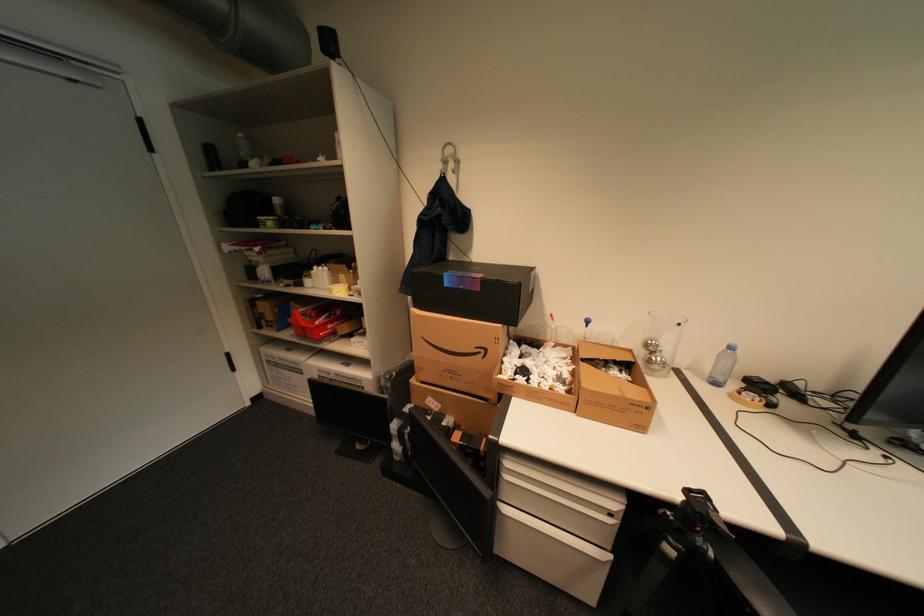
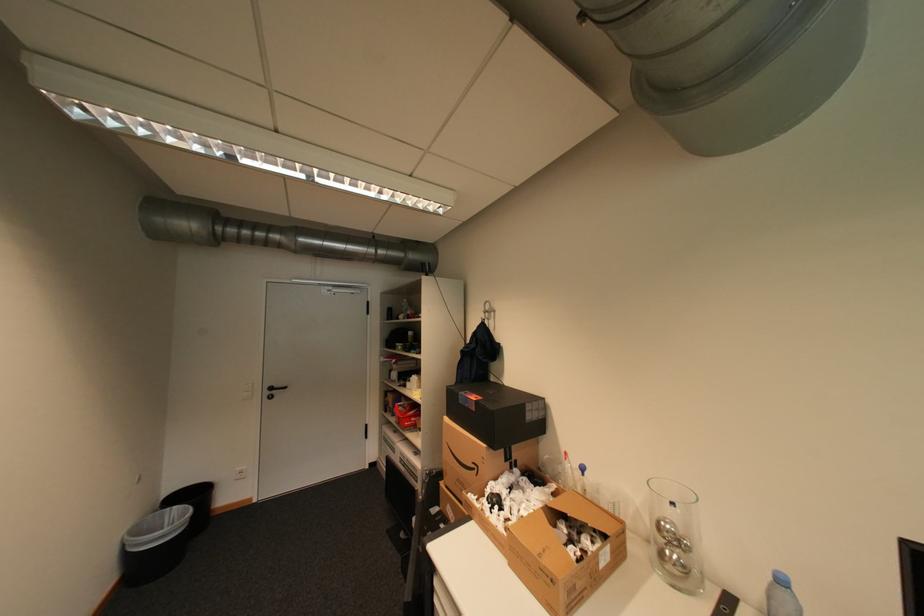
The images are taken continuously from a first-person perspective. In which direction is your viewpoint rotating?

The rotation direction of the camera is left-up.